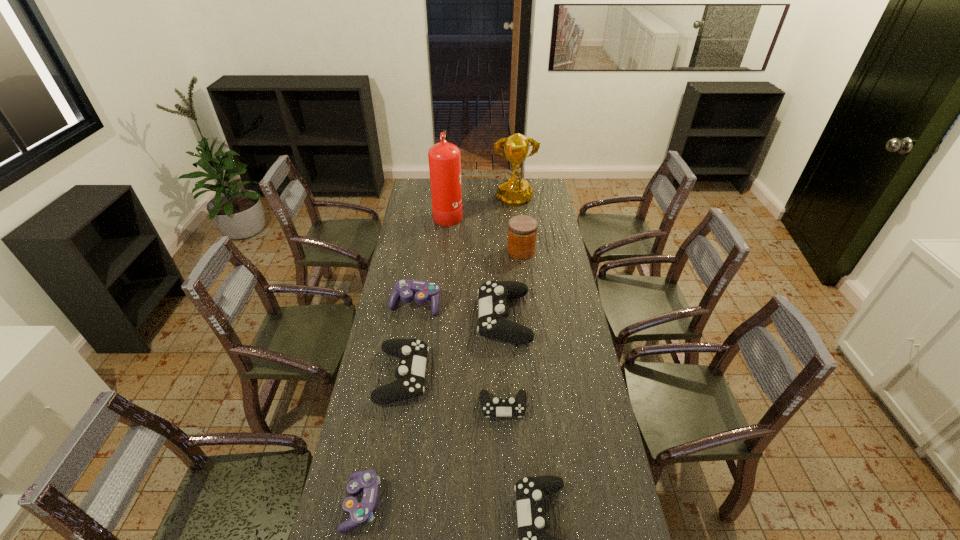
Identify the location of vacant region at the right edge of the desktop. (561, 460).

This screenshot has height=540, width=960. What are the coordinates of `vacant area between the smaller purple control and the tallest control` in the screenshot? It's located at [433, 410].

You are a GUI agent. You are given a task and a screenshot of the screen. Output one action in this format:
    pyautogui.click(x=<x>, y=<y>)
    Task: Click on the free area in between the orange jar and the tallest object
    The width and height of the screenshot is (960, 540).
    Given the screenshot: What is the action you would take?
    pyautogui.click(x=485, y=232)

Locate an element on the screen. Image resolution: width=960 pixels, height=540 pixels. empty location between the sixth shortest object and the farther purple control is located at coordinates (460, 310).

Locate an element on the screen. Image resolution: width=960 pixels, height=540 pixels. object that stands as the third closest to the smaller purple control is located at coordinates (530, 492).

The width and height of the screenshot is (960, 540). Identify the location of the eighth closest object to the shortest object. (515, 191).

Point out which control is positioned as the fifth nearest to the award. Please provide its 2D coordinates. Your answer should be formatted as a tuple, i.e. [(x, y)], where the tuple contains the x and y coordinates of a point satisfying the conditions above.

[(530, 492)]

Locate an element on the screen. The image size is (960, 540). the third closest control relative to the smaller purple control is located at coordinates (530, 492).

At what (x,y) coordinates should I click in order to perform the action: click on black control that can be found as the third closest to the red fire extinguisher. Please return your answer as a coordinate pair (x, y). This screenshot has height=540, width=960. Looking at the image, I should click on (495, 407).

Find the location of `black control that stands as the fourth closest to the award`. black control that stands as the fourth closest to the award is located at coordinates (530, 492).